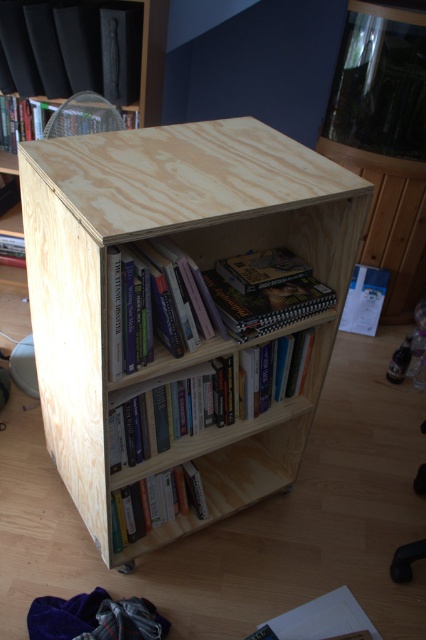
Can you confirm if plywood bookshelf at center is positioned below matte wood book at center?

Yes, plywood bookshelf at center is below matte wood book at center.

Can you confirm if plywood bookshelf at center is positioned to the left of matte wood book at center?

No, plywood bookshelf at center is not to the left of matte wood book at center.

You are a GUI agent. You are given a task and a screenshot of the screen. Output one action in this format:
    pyautogui.click(x=<x>, y=<y>)
    Task: Click on the plywood bookshelf at center
    This screenshot has width=426, height=640.
    Given the screenshot: What is the action you would take?
    pyautogui.click(x=141, y=236)

Is point (155, 112) positioned in front of point (17, 248)?

That is True.

Is plywood bookcase at center shorter than matte wood book at center?

No.

Is point (55, 100) behind point (22, 244)?

No, (55, 100) is in front of (22, 244).

The image size is (426, 640). I want to click on plywood bookcase at center, so click(152, 60).

From the picture: Which of these two, wooden bookshelf at center or hardcover book at lower center, stands taller?

wooden bookshelf at center is taller.

Who is shorter, wooden bookshelf at center or hardcover book at lower center?

With less height is hardcover book at lower center.

Locate an element on the screen. The height and width of the screenshot is (640, 426). wooden bookshelf at center is located at coordinates (218, 408).